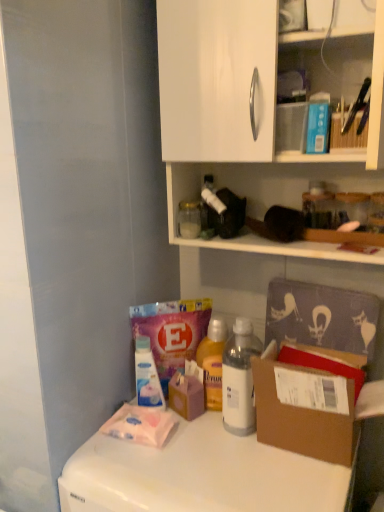
The height and width of the screenshot is (512, 384). Identify the location of free space in front of white plastic bottle at center, the second bottle ordered from the bottom. (246, 469).